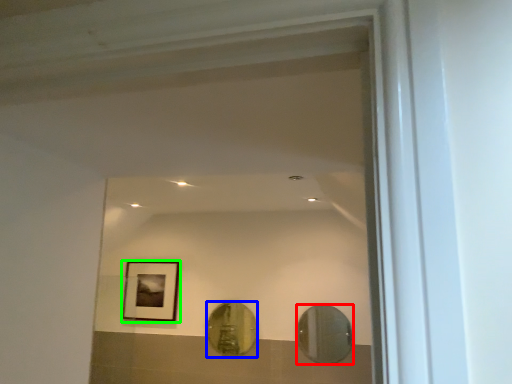
Question: Which object is the farthest from mirror (highlighted by a red box)? Choose among these: mirror (highlighted by a blue box) or picture frame (highlighted by a green box).

Choices:
 (A) mirror
 (B) picture frame

Answer: (B)